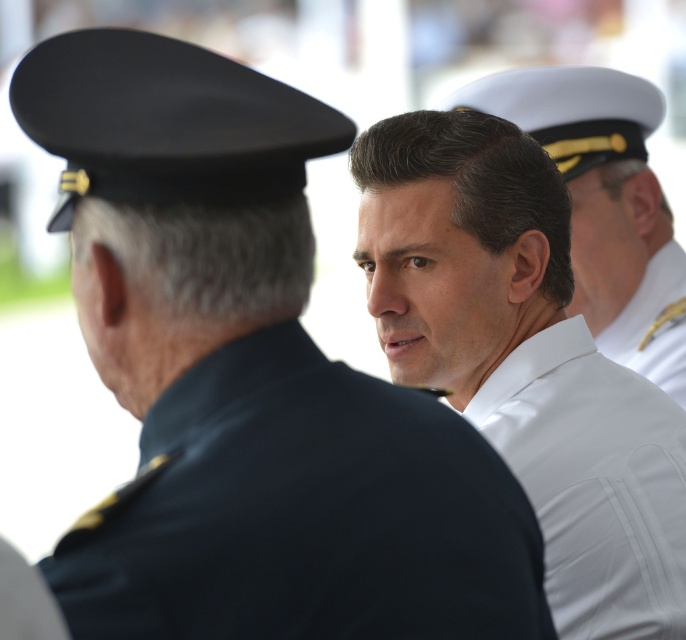
Question: Which object is farther from the camera taking this photo?

Choices:
 (A) white smooth shirt at center
 (B) white glossy uniform at center
 (C) white smooth uniform at center

Answer: (B)

Question: Which point is farther to the camera?

Choices:
 (A) (600, 564)
 (B) (624, 112)

Answer: (B)

Question: Does white smooth uniform at center appear under white smooth shirt at center?

Choices:
 (A) no
 (B) yes

Answer: (A)

Question: Can you confirm if white smooth shirt at center is thinner than white glossy uniform at center?

Choices:
 (A) yes
 (B) no

Answer: (A)

Question: Which object appears closest to the camera in this image?

Choices:
 (A) white smooth uniform at center
 (B) white smooth shirt at center

Answer: (B)

Question: Is white smooth shirt at center positioned before white glossy uniform at center?

Choices:
 (A) yes
 (B) no

Answer: (A)